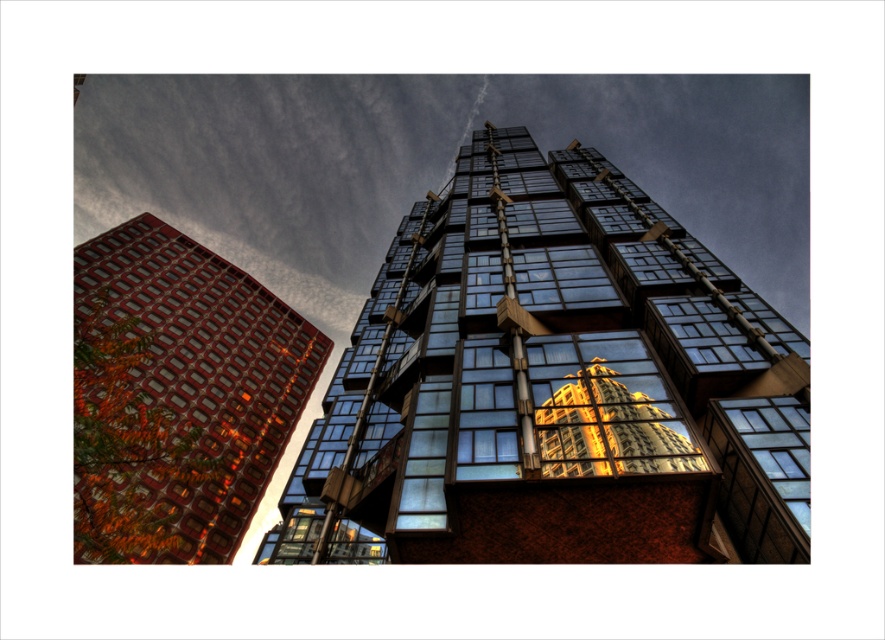
Question: Considering the real-world distances, which object is closest to the glassy reflective building at center?

Choices:
 (A) glossy glass building at center
 (B) red brick building at left

Answer: (A)

Question: Does glassy reflective building at center lie behind glossy glass building at center?

Choices:
 (A) no
 (B) yes

Answer: (A)

Question: Observing the image, what is the correct spatial positioning of red brick building at left in reference to glossy glass building at center?

Choices:
 (A) below
 (B) above

Answer: (A)

Question: Estimate the real-world distances between objects in this image. Which object is farther from the glossy glass building at center?

Choices:
 (A) red brick building at left
 (B) glassy reflective building at center

Answer: (A)

Question: Can you confirm if red brick building at left is positioned above glossy glass building at center?

Choices:
 (A) yes
 (B) no

Answer: (B)

Question: Estimate the real-world distances between objects in this image. Which object is farther from the glossy glass building at center?

Choices:
 (A) glassy reflective building at center
 (B) red brick building at left

Answer: (B)